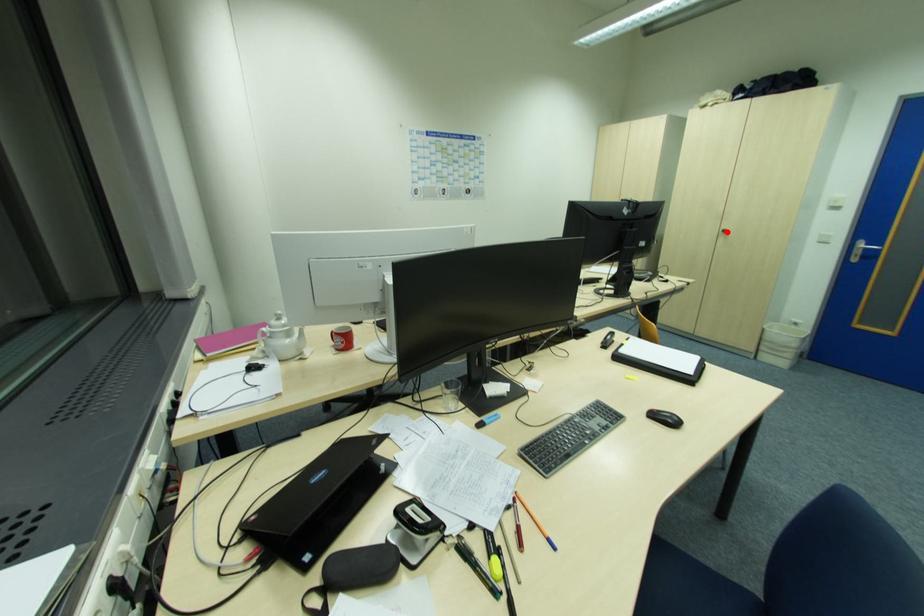
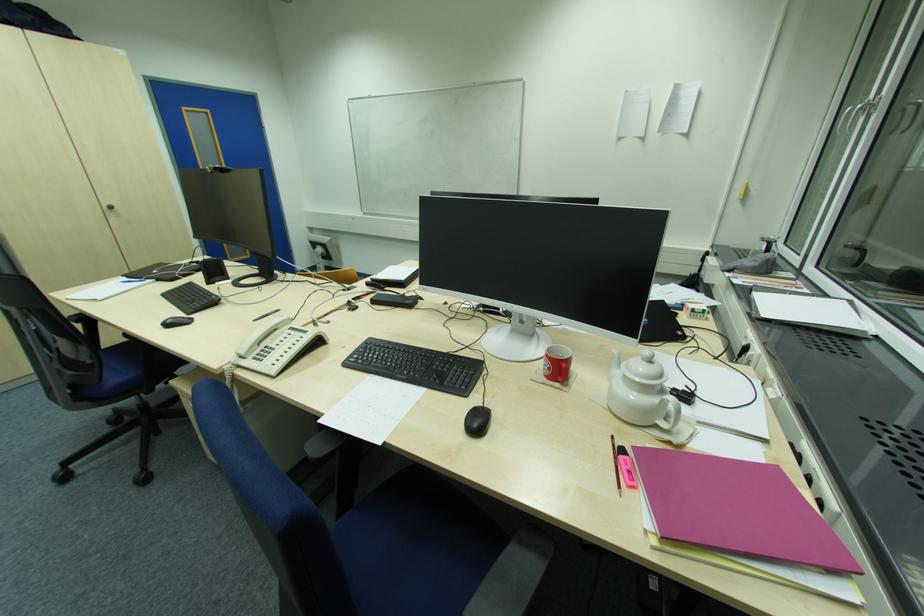
Where in the second image is the point corresponding to the highlighted location from the first image?

(114, 209)